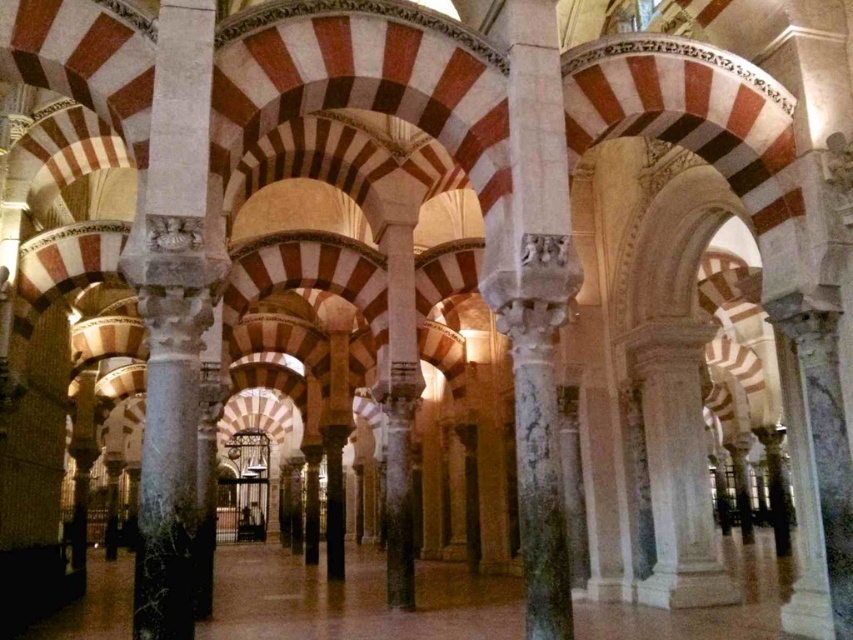
Is point (152, 520) in front of point (486, 234)?

That is True.

Can you confirm if marble column at left is positioned to the right of marble column at center?

Incorrect, marble column at left is not on the right side of marble column at center.

Is point (164, 508) more distant than point (488, 292)?

No.

At what (x,y) coordinates should I click in order to perform the action: click on marble column at left. Please return your answer as a coordinate pair (x, y). The image size is (853, 640). Looking at the image, I should click on (172, 314).